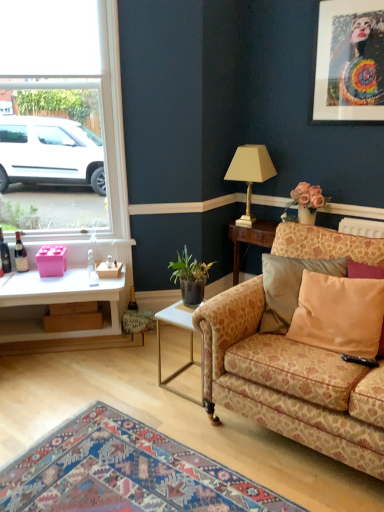
Locate an element on the screen. The image size is (384, 512). unoccupied space behind white metal side table at lower center is located at coordinates (170, 353).